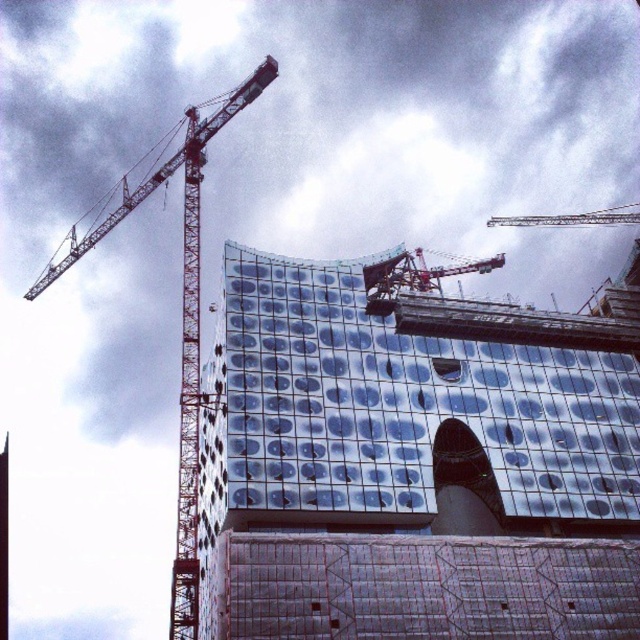
Who is positioned more to the right, reddish metallic crane at left or metallic silver crane at upper center?

metallic silver crane at upper center is more to the right.

Is reddish metallic crane at left to the right of metallic silver crane at upper center from the viewer's perspective?

In fact, reddish metallic crane at left is to the left of metallic silver crane at upper center.

Which is in front, point (120, 182) or point (506, 221)?

Point (506, 221) is in front.

I want to click on reddish metallic crane at left, so click(x=180, y=312).

Does metallic glass building at center have a smaller size compared to reddish metallic crane at left?

Yes, metallic glass building at center is smaller than reddish metallic crane at left.

Where is `metallic glass building at center`? metallic glass building at center is located at coordinates (413, 461).

Which is behind, point (346, 428) or point (508, 220)?

Positioned behind is point (508, 220).

Does metallic glass building at center appear on the right side of metallic silver crane at upper center?

No, metallic glass building at center is not to the right of metallic silver crane at upper center.

Between point (381, 461) and point (552, 216), which one is positioned behind?

The point (552, 216) is more distant.

I want to click on metallic glass building at center, so click(413, 461).